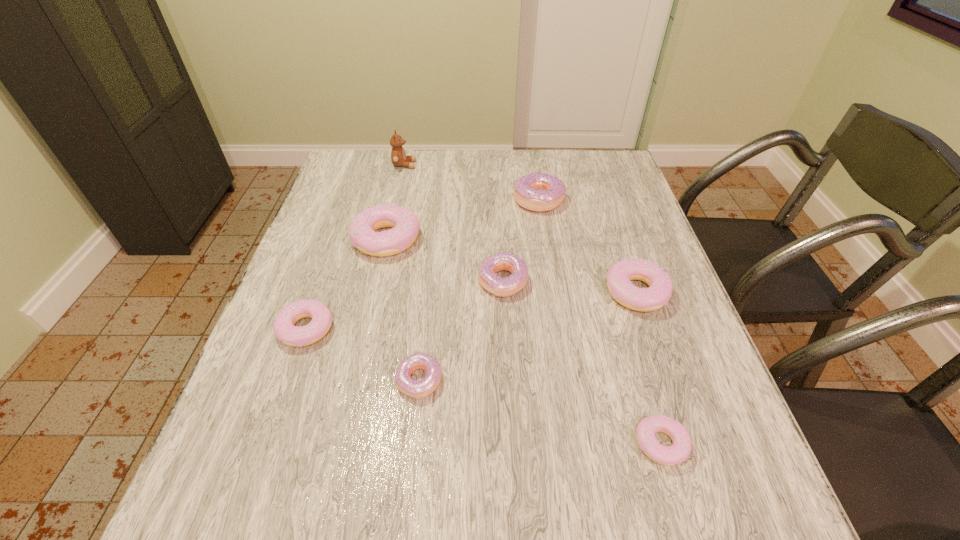
The image size is (960, 540). Identify the location of vacant space situated on the left of the shortest doughnut. (526, 444).

Find the location of a particular element. teddy bear that is positioned at the far edge is located at coordinates (398, 156).

This screenshot has width=960, height=540. Find the location of `doughnut positioned at the far edge`. doughnut positioned at the far edge is located at coordinates (540, 192).

I want to click on vacant region at the far edge of the desktop, so click(x=464, y=165).

Locate an element on the screen. vacant area at the left edge of the desktop is located at coordinates (373, 204).

Identify the location of vacant point at the right edge. (678, 356).

Locate an element on the screen. This screenshot has width=960, height=540. vacant space at the far left corner of the desktop is located at coordinates (354, 154).

Locate an element on the screen. Image resolution: width=960 pixels, height=540 pixels. vacant space at the far right corner is located at coordinates (605, 179).

I want to click on empty location between the third smallest pink doughnut and the second smallest purple doughnut, so click(x=569, y=287).

At what (x,y) coordinates should I click in order to perform the action: click on empty space between the third smallest pink doughnut and the farthest object. Please return your answer as a coordinate pair (x, y). The width and height of the screenshot is (960, 540). Looking at the image, I should click on (520, 228).